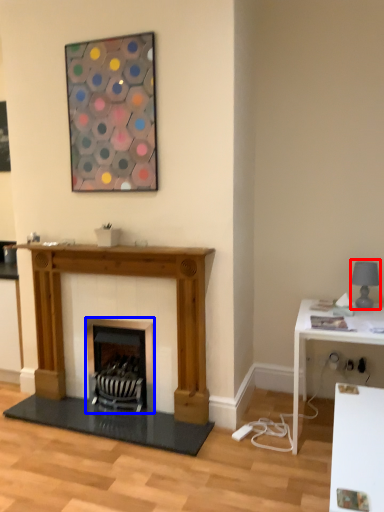
Question: Which object appears closest to the camera in this image, lamp (highlighted by a red box) or wood burning stove (highlighted by a blue box)?

Choices:
 (A) lamp
 (B) wood burning stove

Answer: (A)